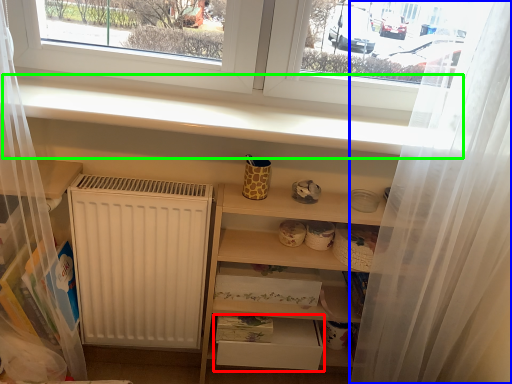
Question: Based on their relative distances, which object is nearer to drawer (highlighted by a red box)? Choose from shower curtain (highlighted by a blue box) and window sill (highlighted by a green box).

Choices:
 (A) shower curtain
 (B) window sill

Answer: (A)